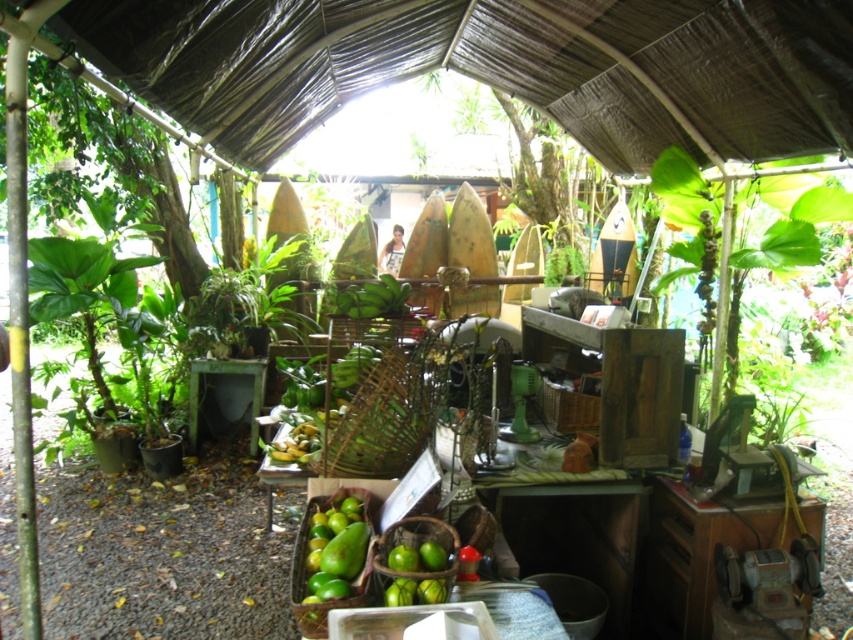
Who is more distant from viewer, [318,518] or [466,100]?

Positioned behind is point [466,100].

Who is more forward, [357,548] or [486,128]?

Point [357,548] is more forward.

I want to click on green matte mangoes at lower center, so click(335, 550).